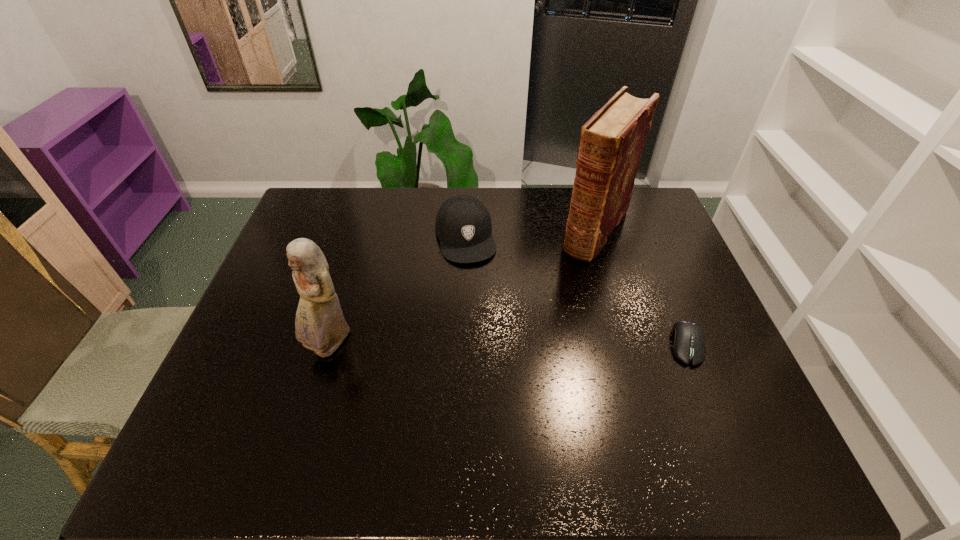
The height and width of the screenshot is (540, 960). In the image, there is a desktop. Identify the location of vacant space at the near edge. (346, 408).

Locate an element on the screen. This screenshot has height=540, width=960. vacant space at the left edge of the desktop is located at coordinates (264, 300).

In the image, there is a desktop. Identify the location of vacant space at the right edge. The height and width of the screenshot is (540, 960). (678, 247).

This screenshot has height=540, width=960. In order to click on free space at the near left corner of the desktop in this screenshot , I will do `click(240, 416)`.

This screenshot has width=960, height=540. In order to click on free space at the far right corner of the desktop in this screenshot , I will do point(657,209).

Image resolution: width=960 pixels, height=540 pixels. Identify the location of vacant region between the computer equipment and the leftmost object. (509, 345).

Identify the location of vacant space that is in between the shortest object and the second tallest object. (509, 345).

Where is `unoccupied position between the computer equipment and the third object from right to left`? The height and width of the screenshot is (540, 960). unoccupied position between the computer equipment and the third object from right to left is located at coordinates (576, 291).

This screenshot has height=540, width=960. What are the coordinates of `vacant space that's between the second shortest object and the hardback book` in the screenshot? It's located at (531, 233).

Find the location of `free spot between the tallest object and the cap`. free spot between the tallest object and the cap is located at coordinates (531, 233).